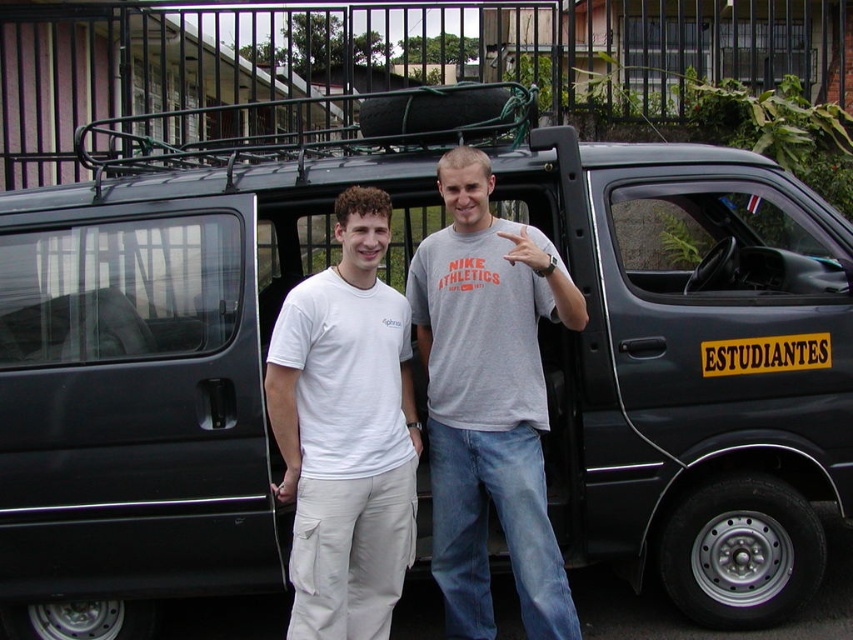
Question: Is gray cotton t-shirt at center wider than white cotton t-shirt at center?

Choices:
 (A) yes
 (B) no

Answer: (A)

Question: Which object appears closest to the camera in this image?

Choices:
 (A) white cotton t-shirt at center
 (B) gray cotton t-shirt at center

Answer: (A)

Question: Which point is closer to the camera?

Choices:
 (A) white cotton t-shirt at center
 (B) gray cotton t-shirt at center

Answer: (A)

Question: Is gray cotton t-shirt at center above white cotton t-shirt at center?

Choices:
 (A) yes
 (B) no

Answer: (A)

Question: Is gray cotton t-shirt at center positioned behind white cotton t-shirt at center?

Choices:
 (A) no
 (B) yes

Answer: (B)

Question: Which of the following is the closest to the observer?

Choices:
 (A) gray cotton t-shirt at center
 (B) white cotton t-shirt at center

Answer: (B)